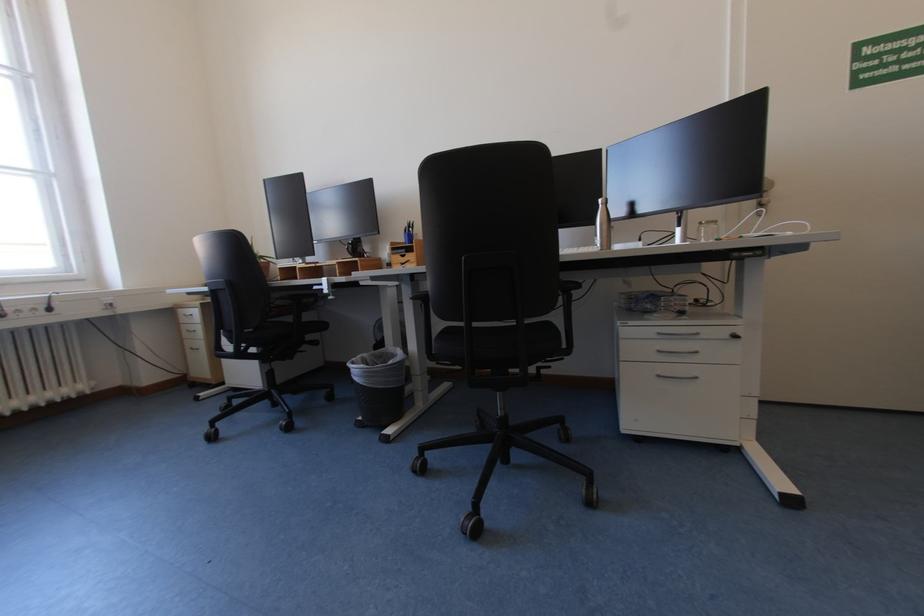
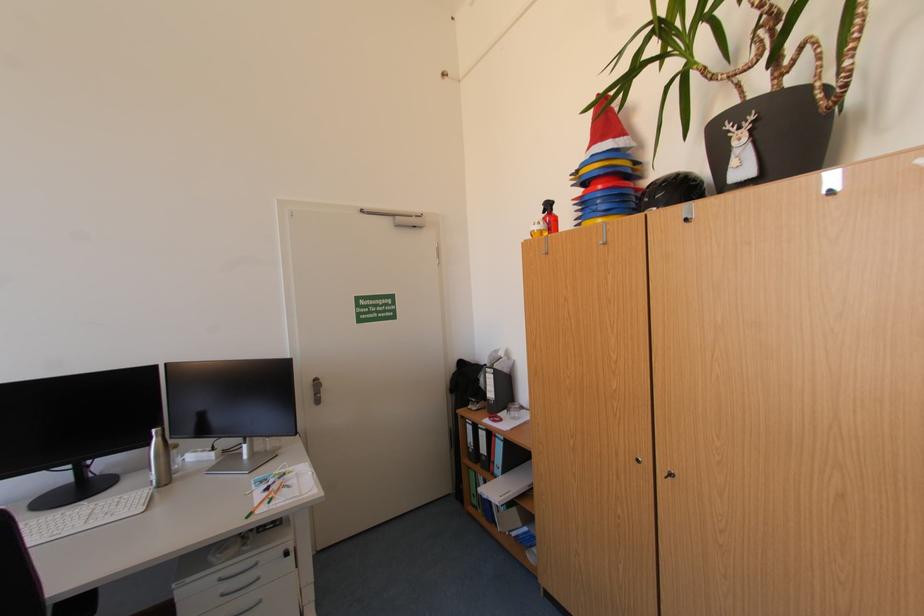
Where in the second image is the point corresponding to (608,201) from the first image?

(161, 431)